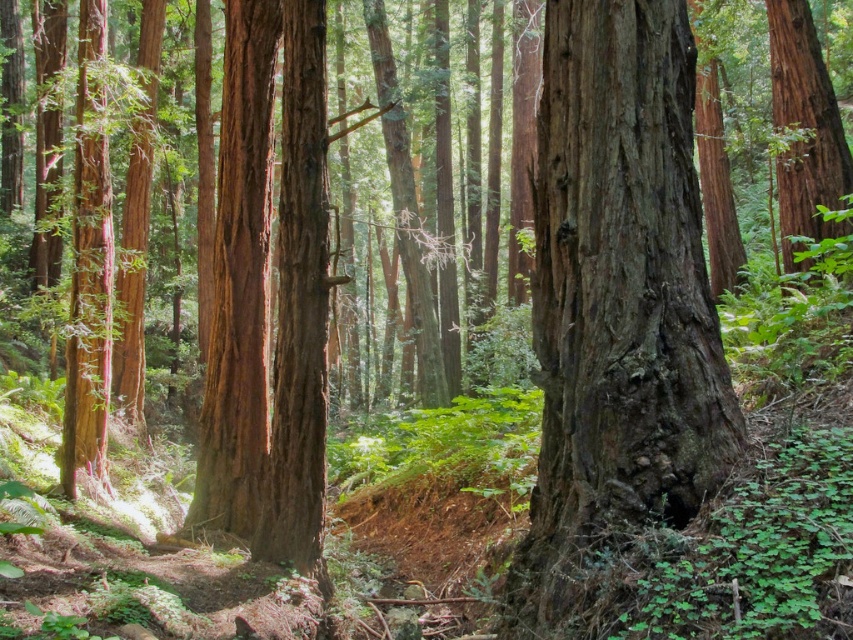
Measure the distance between rough bark tree at center and smooth brown tree trunk at right.

rough bark tree at center is 6.78 meters away from smooth brown tree trunk at right.

The image size is (853, 640). In order to click on rough bark tree at center in this screenshot , I will do `click(618, 317)`.